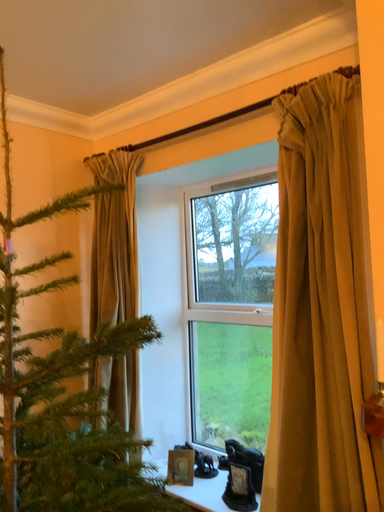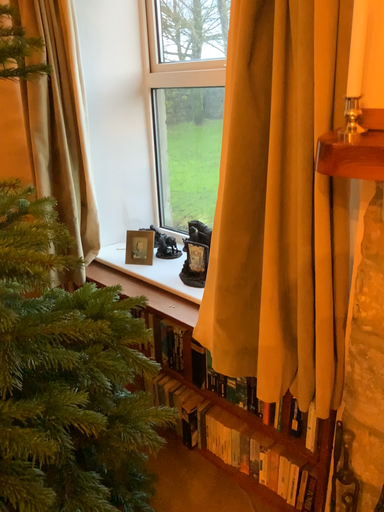
Question: How did the camera likely rotate when shooting the video?

Choices:
 (A) rotated downward
 (B) rotated upward

Answer: (A)